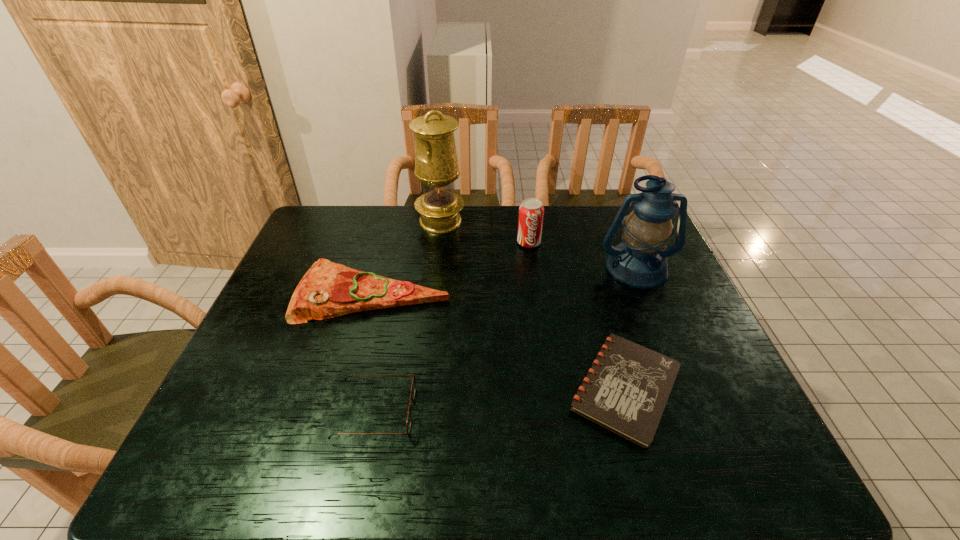
This screenshot has width=960, height=540. In order to click on free space located 0.310m on the front-facing side of the sunglasses in this screenshot , I will do `click(555, 412)`.

Image resolution: width=960 pixels, height=540 pixels. I want to click on vacant area located on the left of the shortest object, so click(x=522, y=388).

The height and width of the screenshot is (540, 960). Find the location of `oil lamp that is positioned at the far edge`. oil lamp that is positioned at the far edge is located at coordinates (436, 165).

Find the location of a particular element. Image resolution: width=960 pixels, height=540 pixels. soda can at the far edge is located at coordinates (531, 212).

In order to click on sunglasses positioned at the near edge in this screenshot , I will do `click(413, 387)`.

Image resolution: width=960 pixels, height=540 pixels. I want to click on notebook positioned at the near edge, so click(x=626, y=390).

Identify the location of object present at the left edge. The height and width of the screenshot is (540, 960). (327, 290).

Locate an element on the screen. The image size is (960, 540). lantern located in the right edge section of the desktop is located at coordinates (640, 260).

Where is `notebook that is at the right edge`? notebook that is at the right edge is located at coordinates (626, 390).

At what (x,y) coordinates should I click in order to perform the action: click on object positioned at the near right corner. Please return your answer as a coordinate pair (x, y). This screenshot has height=540, width=960. Looking at the image, I should click on (x=626, y=390).